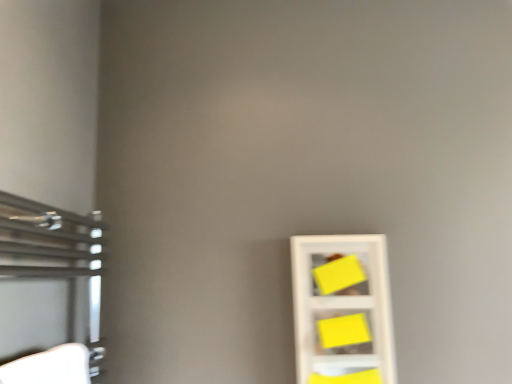
Identify the location of yellow matte bookshelf at right. The width and height of the screenshot is (512, 384). (342, 309).

The height and width of the screenshot is (384, 512). What do you see at coordinates (342, 309) in the screenshot?
I see `yellow matte bookshelf at right` at bounding box center [342, 309].

Consider the image. What is the approximate width of yellow matte bookshelf at right?

yellow matte bookshelf at right is 5.16 centimeters wide.

Find the location of `yellow matte bookshelf at right`. yellow matte bookshelf at right is located at coordinates (342, 309).